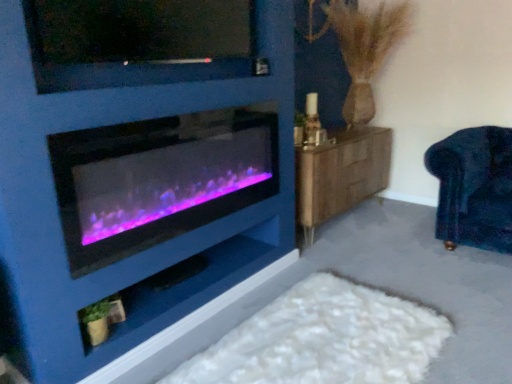
You are a GUI agent. You are given a task and a screenshot of the screen. Output one action in this format:
    pyautogui.click(x=<x>, y=<y>)
    Task: Click on the free space to the back side of white fluffy rug at lower center
    This screenshot has height=384, width=512.
    Given the screenshot: What is the action you would take?
    pyautogui.click(x=342, y=258)